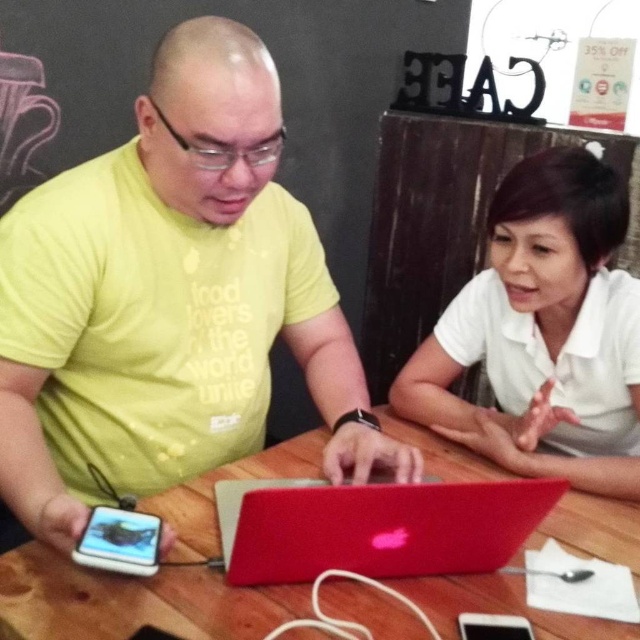
Question: Estimate the real-world distances between objects in this image. Which object is closer to the wooden table at center?

Choices:
 (A) matte yellow t-shirt at center
 (B) black matte smartphone at lower center

Answer: (A)

Question: Can you confirm if matte yellow t-shirt at center is wider than black matte smartphone at lower center?

Choices:
 (A) no
 (B) yes

Answer: (B)

Question: Is wooden table at center to the left of black matte smartphone at lower center from the viewer's perspective?

Choices:
 (A) yes
 (B) no

Answer: (A)

Question: Based on their relative distances, which object is nearer to the white matte shirt at center?

Choices:
 (A) wooden table at center
 (B) matte yellow t-shirt at center
 (C) matte black phone at lower left
 (D) black matte smartphone at lower center

Answer: (A)

Question: Among these objects, which one is farthest from the camera?

Choices:
 (A) matte yellow t-shirt at center
 (B) black matte smartphone at lower center

Answer: (B)

Question: Is white matte shirt at center bigger than wooden table at center?

Choices:
 (A) yes
 (B) no

Answer: (A)